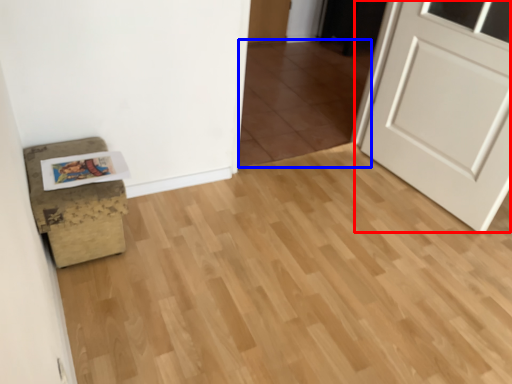
Question: Which object is closer to the camera taking this photo, door (highlighted by a red box) or tile (highlighted by a blue box)?

Choices:
 (A) door
 (B) tile

Answer: (A)